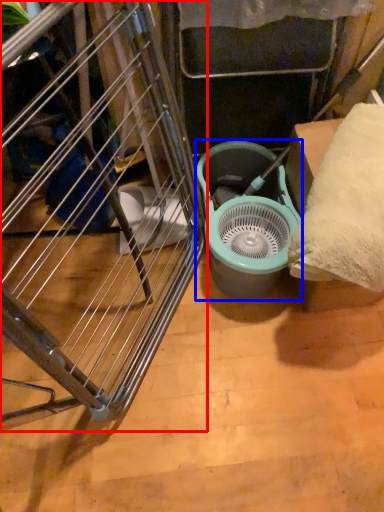
Question: Which object appears closest to the camera in this image, furniture (highlighted by a red box) or mechanical fan (highlighted by a blue box)?

Choices:
 (A) furniture
 (B) mechanical fan

Answer: (A)